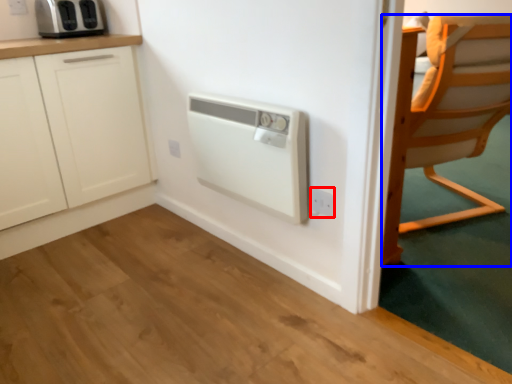
Question: Which object appears farthest to the camera in this image, electric outlet (highlighted by a red box) or chair (highlighted by a blue box)?

Choices:
 (A) electric outlet
 (B) chair

Answer: (B)